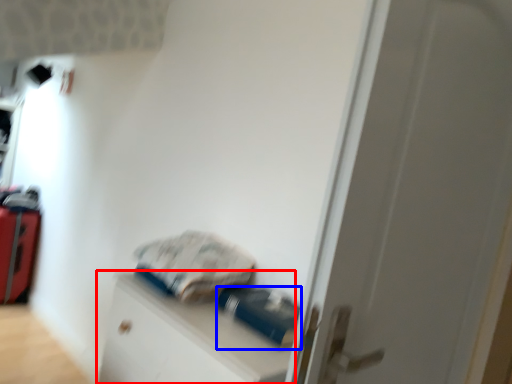
Question: Which of the following is the closest to the observer, file cabinet (highlighted by a red box) or equipment (highlighted by a blue box)?

Choices:
 (A) file cabinet
 (B) equipment

Answer: (A)